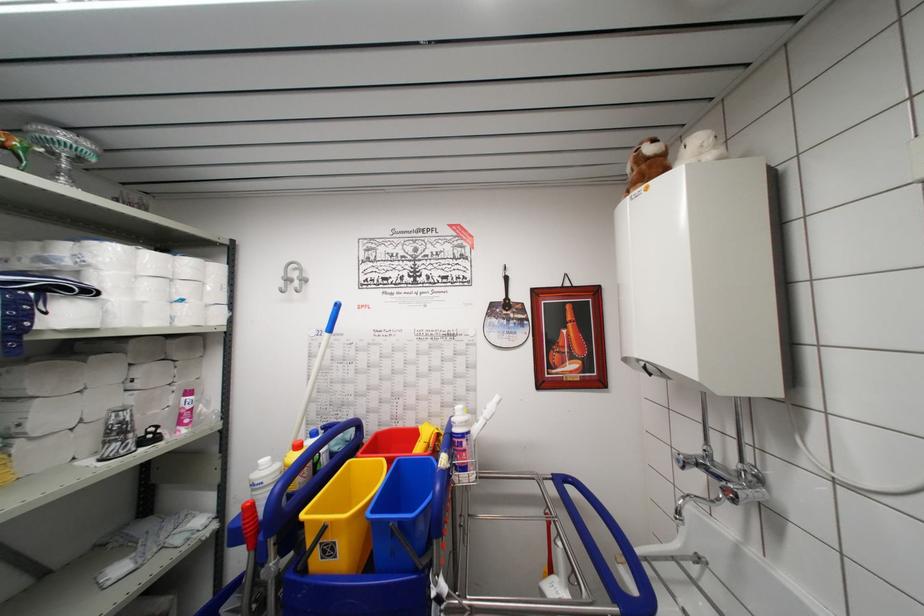
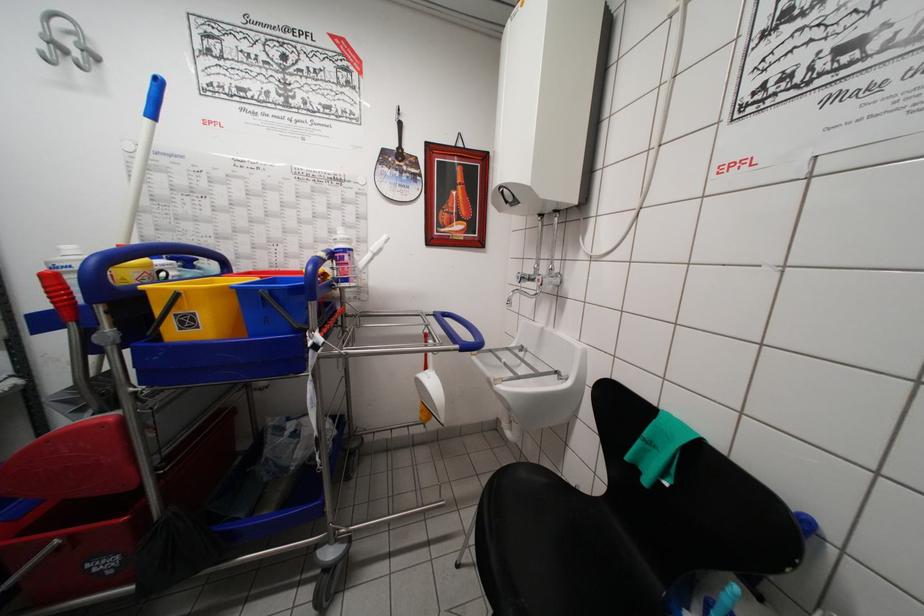
Question: Based on the continuous images, in which direction is the camera rotating? Reply with the corresponding letter.

Choices:
 (A) Left
 (B) Right
 (C) Up
 (D) Down

Answer: (B)